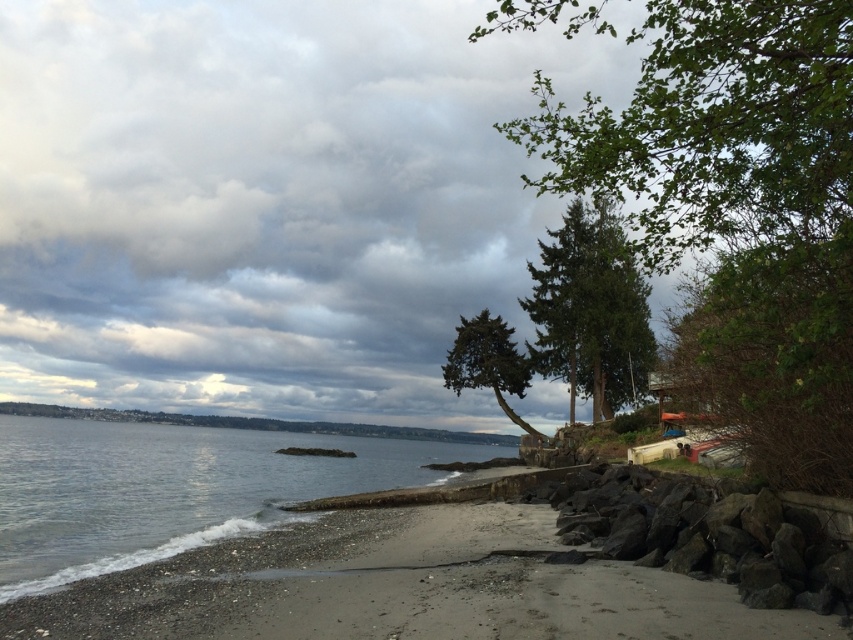
Question: Which object is positioned closest to the clear water at lower left?

Choices:
 (A) black rock at lower right
 (B) green leafy tree at right
 (C) green textured tree at upper right
 (D) green leafy tree at center

Answer: (C)

Question: Which object is farther from the camera taking this photo?

Choices:
 (A) smooth sand beach at lower left
 (B) green textured tree at center
 (C) green leafy tree at right

Answer: (B)

Question: Is black rock at lower right further to the viewer compared to green textured tree at upper right?

Choices:
 (A) no
 (B) yes

Answer: (B)

Question: Is smooth sand beach at lower left bigger than black rock at lower right?

Choices:
 (A) no
 (B) yes

Answer: (B)

Question: Which point is farther to the camera?

Choices:
 (A) (680, 92)
 (B) (637, 371)
 (C) (674, 508)
 (D) (0, 624)

Answer: (B)

Question: Does clear water at lower left appear over black rock at lower right?

Choices:
 (A) no
 (B) yes

Answer: (A)